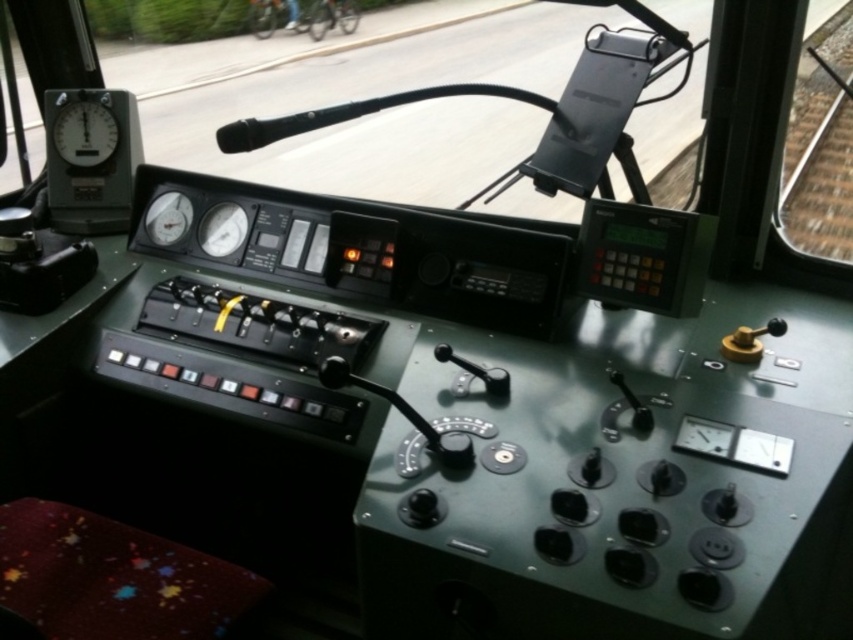
Question: Which point is closer to the camera?

Choices:
 (A) (102, 156)
 (B) (341, 17)
 (C) (265, 20)

Answer: (A)

Question: From the image, what is the correct spatial relationship of metallic bicycle at upper center in relation to metallic bicycle at center?

Choices:
 (A) below
 (B) above

Answer: (A)

Question: Does matte black gauge at upper left have a greater width compared to metallic bicycle at center?

Choices:
 (A) no
 (B) yes

Answer: (A)

Question: Estimate the real-world distances between objects in this image. Which object is farther from the metallic bicycle at center?

Choices:
 (A) matte black gauge at upper left
 (B) metallic bicycle at upper center

Answer: (A)

Question: Which point appears closest to the camera in this image?

Choices:
 (A) (56, 141)
 (B) (270, 3)

Answer: (A)

Question: Is matte black gauge at upper left further to camera compared to metallic bicycle at upper center?

Choices:
 (A) no
 (B) yes

Answer: (A)